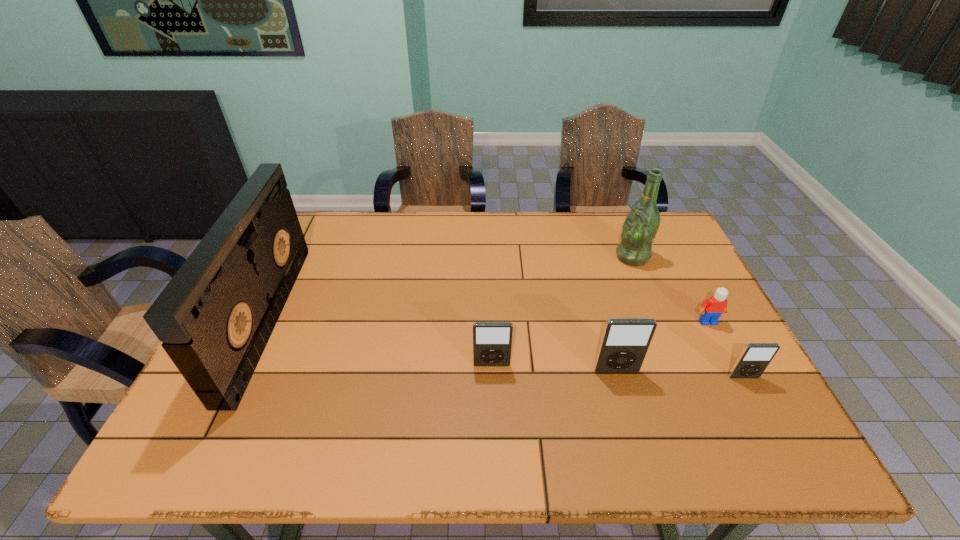
Image resolution: width=960 pixels, height=540 pixels. What are the coordinates of `iPod that is at the right edge` in the screenshot? It's located at (755, 357).

Find the location of `beer bottle present at the right edge`. beer bottle present at the right edge is located at coordinates (640, 227).

I want to click on Lego located at the right edge, so click(712, 308).

Image resolution: width=960 pixels, height=540 pixels. In order to click on object that is at the far left corner in this screenshot , I will do `click(215, 317)`.

What are the coordinates of `object that is at the near left corner` in the screenshot? It's located at (215, 317).

The height and width of the screenshot is (540, 960). I want to click on object at the far right corner, so click(x=640, y=227).

Find the location of `free region at the far edge of the desktop`. free region at the far edge of the desktop is located at coordinates (611, 219).

The height and width of the screenshot is (540, 960). Find the location of `vacant space at the near edge`. vacant space at the near edge is located at coordinates (629, 412).

Where is `vacant space at the left edge of the desktop`? The image size is (960, 540). vacant space at the left edge of the desktop is located at coordinates pos(264,358).

You are a GUI agent. You are given a task and a screenshot of the screen. Output one action in this format:
    pyautogui.click(x=<x>, y=<y>)
    Task: Click on the vacant region at the near right corner
    The height and width of the screenshot is (540, 960).
    Given the screenshot: What is the action you would take?
    pyautogui.click(x=706, y=398)